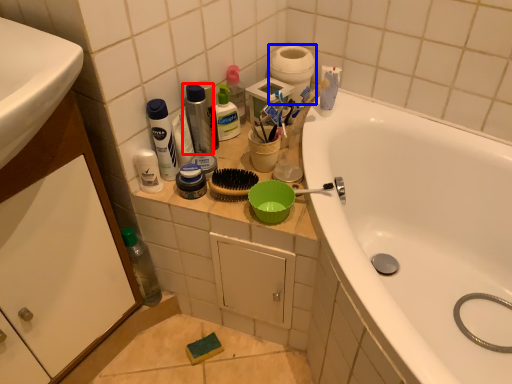
Question: Which object is further to the camera taking this photo, cleaning product (highlighted by a red box) or toilet paper (highlighted by a blue box)?

Choices:
 (A) cleaning product
 (B) toilet paper

Answer: (B)